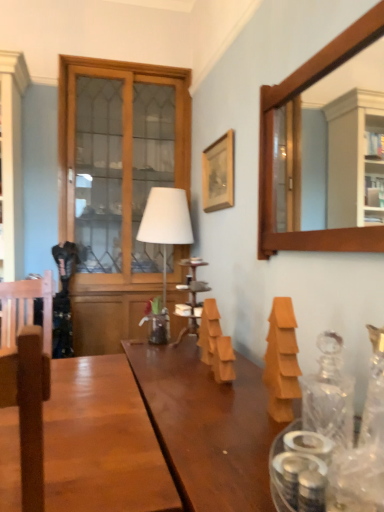
Question: Considering their positions, is wooden cabinet with glass doors at left located in front of or behind orange matte wooden blocks at center, which is the 2th wood from right to left?

Choices:
 (A) behind
 (B) front

Answer: (A)

Question: From the image's perspective, relative to orange matte wooden blocks at center, acting as the 2th wood starting from the front, is wooden cabinet with glass doors at left above or below?

Choices:
 (A) above
 (B) below

Answer: (A)

Question: Which is farther from the white matte table lamp at center?

Choices:
 (A) wooden frame mirror at upper right
 (B) orange matte wooden block at right, which ranks as the 1th wood in right-to-left order
 (C) wooden picture frame at upper center
 (D) brown wood swivel chair at left
 (E) clear glass vase at right

Answer: (E)

Question: Which is nearer to the transparent glass decanter at right?

Choices:
 (A) orange matte wooden blocks at center, acting as the 2th wood starting from the front
 (B) wooden picture frame at upper center
 (C) white matte table lamp at center
 (D) wooden frame mirror at upper right
 (E) orange matte wooden block at right, which is the second wood in left-to-right order

Answer: (E)